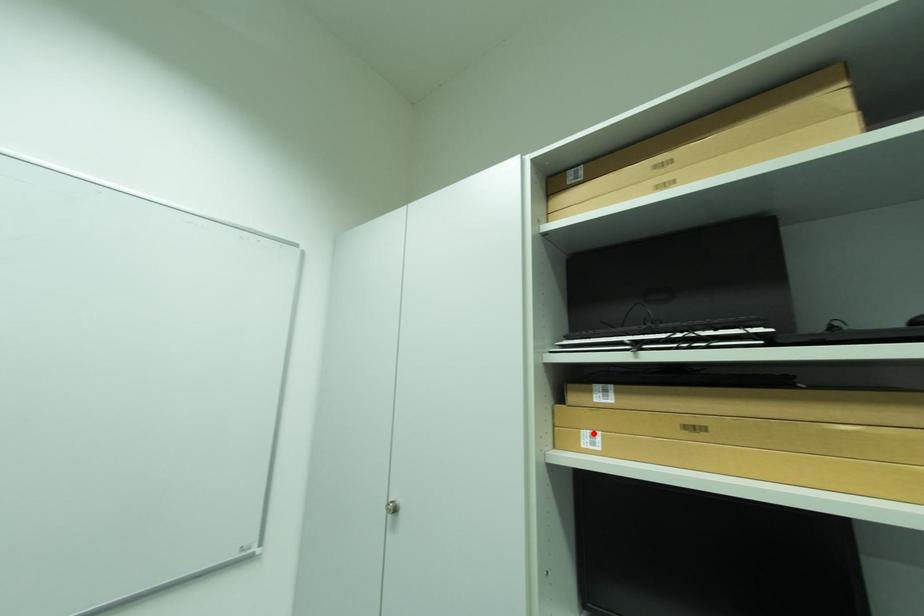
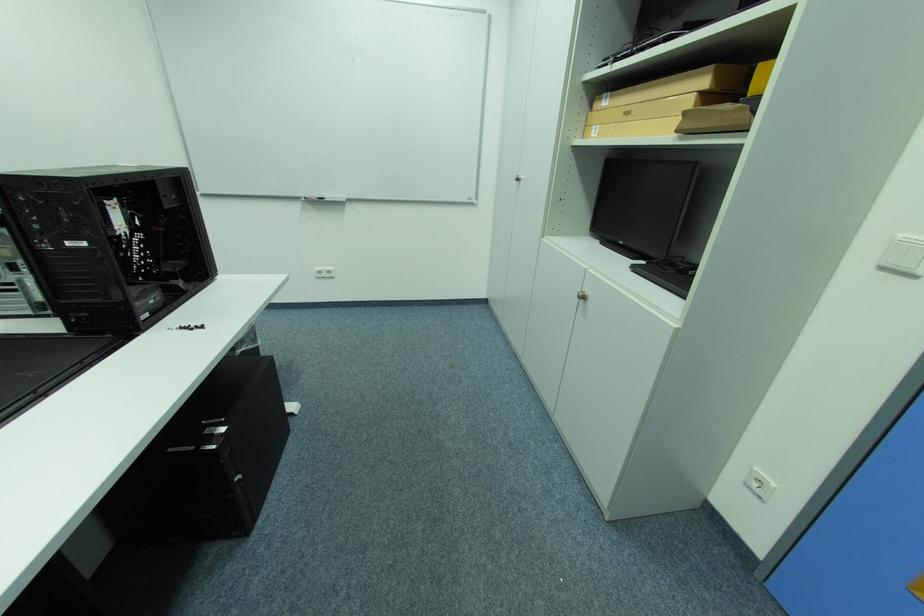
Question: I am providing you with two images of the same scene from different viewpoints. Given a red point in image1, look at the same physical point in image2. Is it:

Choices:
 (A) Closer to the viewpoint
 (B) Farther from the viewpoint

Answer: (A)